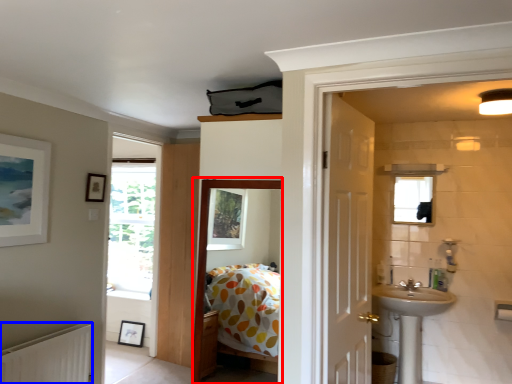
Question: Which object appears farthest to the camera in this image, corridor (highlighted by a red box) or radiator (highlighted by a blue box)?

Choices:
 (A) corridor
 (B) radiator

Answer: (B)